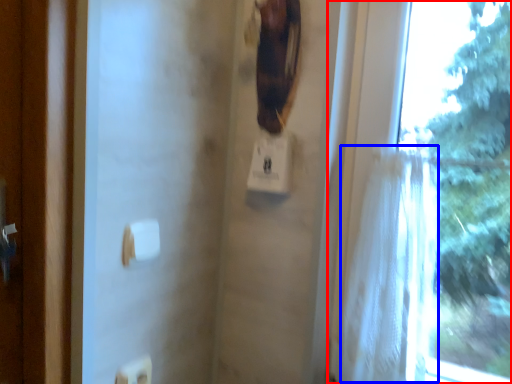
Question: Which point is closer to the camera, window (highlighted by a red box) or shower curtain (highlighted by a blue box)?

Choices:
 (A) window
 (B) shower curtain

Answer: (A)